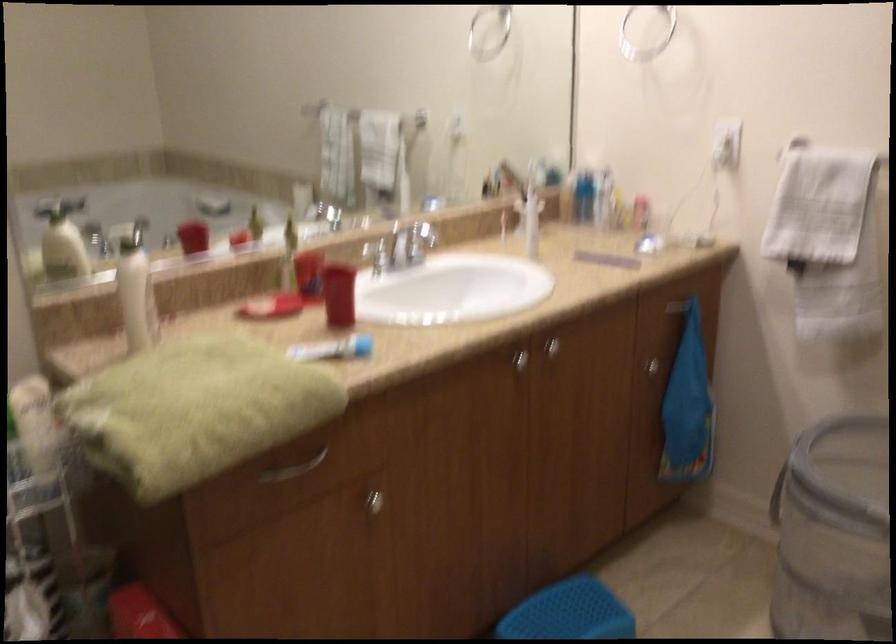
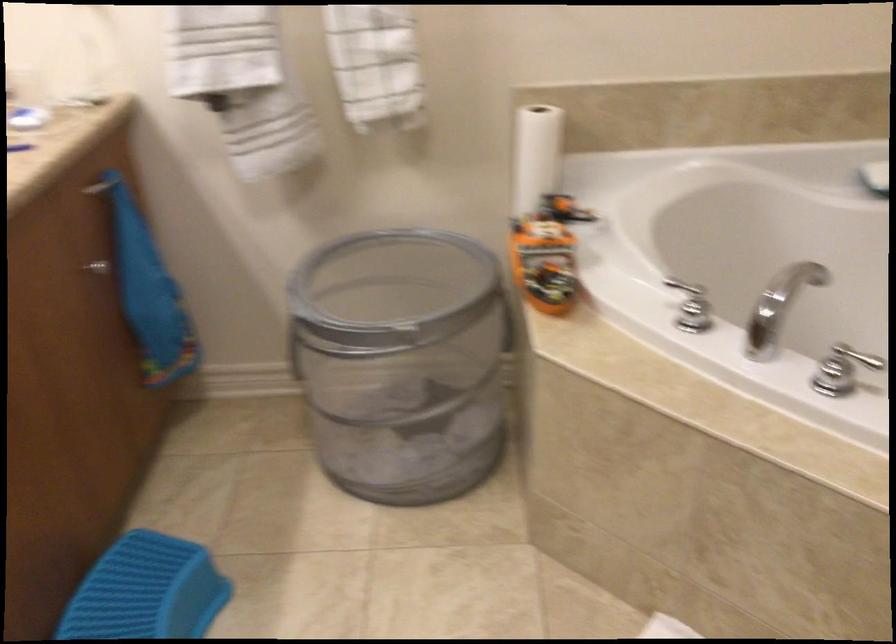
Where in the second image is the point corresponding to the point at 650,363 from the first image?

(97, 267)